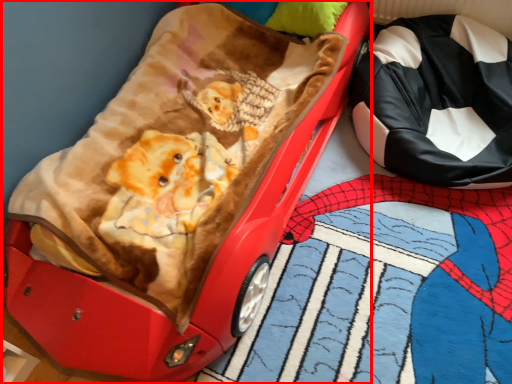
Question: From the image's perspective, what is the correct spatial positioning of furniture (annotated by the red box) in reference to pillow?

Choices:
 (A) above
 (B) below

Answer: (B)